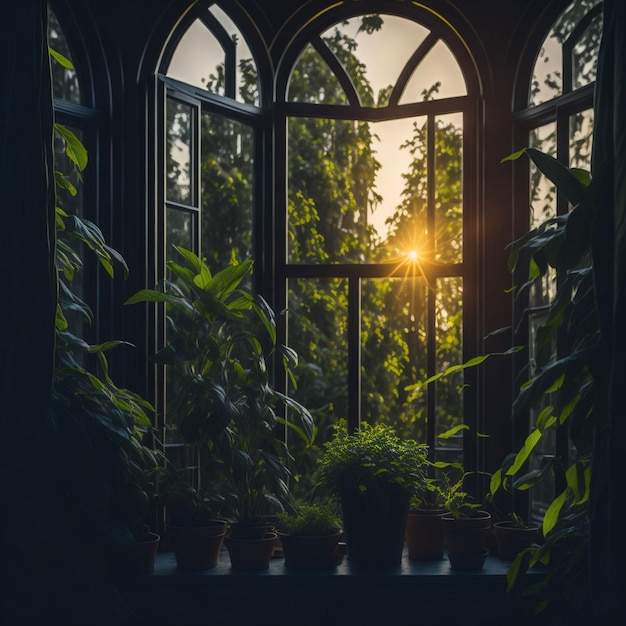
This screenshot has height=626, width=626. Find the location of `plant pots`. plant pots is located at coordinates tap(136, 563), tap(193, 555), tap(247, 556), tap(310, 556), tap(382, 536), tap(428, 538), tap(464, 548), tap(509, 545), tap(275, 548).